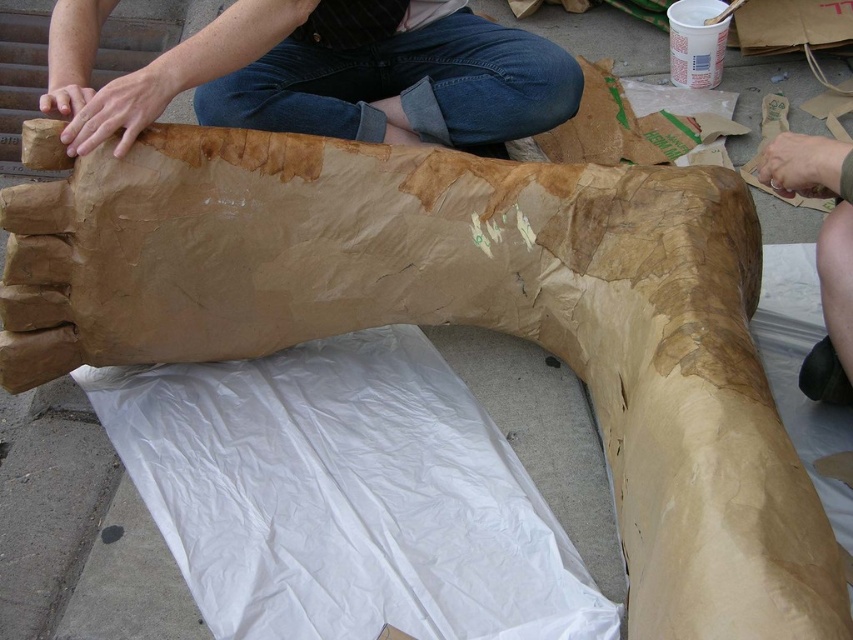
Question: Can you confirm if brown paper at upper center is positioned to the right of skinny brown paper at right?

Choices:
 (A) no
 (B) yes

Answer: (A)

Question: Can you confirm if brown paper at upper center is smaller than skinny brown paper at right?

Choices:
 (A) no
 (B) yes

Answer: (A)

Question: Which point appears closest to the camera in this image?

Choices:
 (A) pyautogui.click(x=408, y=51)
 (B) pyautogui.click(x=844, y=342)

Answer: (B)

Question: Among these objects, which one is nearest to the camera?

Choices:
 (A) brown paper at upper center
 (B) skinny brown paper at right

Answer: (B)

Question: Does brown paper at upper center lie in front of skinny brown paper at right?

Choices:
 (A) yes
 (B) no

Answer: (B)